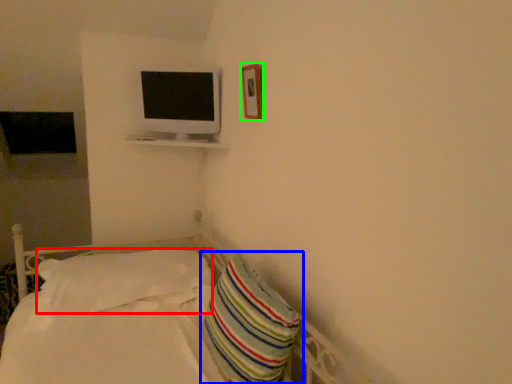
Question: Based on their relative distances, which object is farther from pillow (highlighted by a red box)? Choose from pillow (highlighted by a blue box) and picture frame (highlighted by a green box).

Choices:
 (A) pillow
 (B) picture frame

Answer: (B)